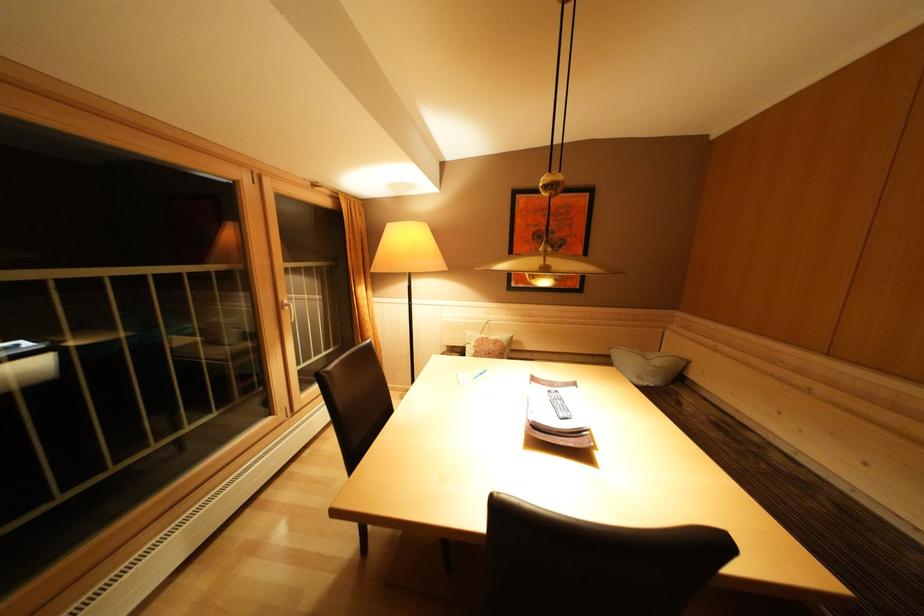
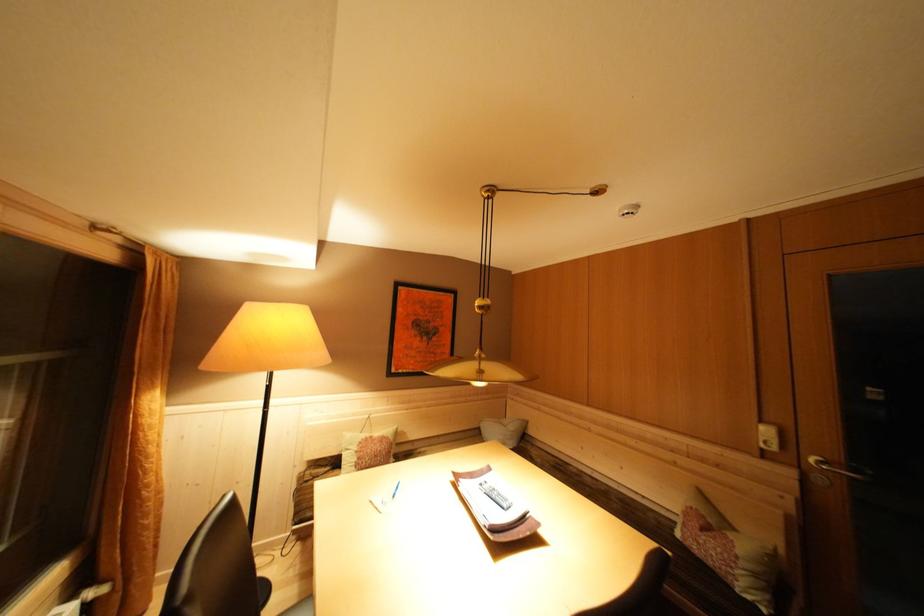
Locate, in the second image, the point that corresponds to pixel 556 397 in the first image.

(488, 488)